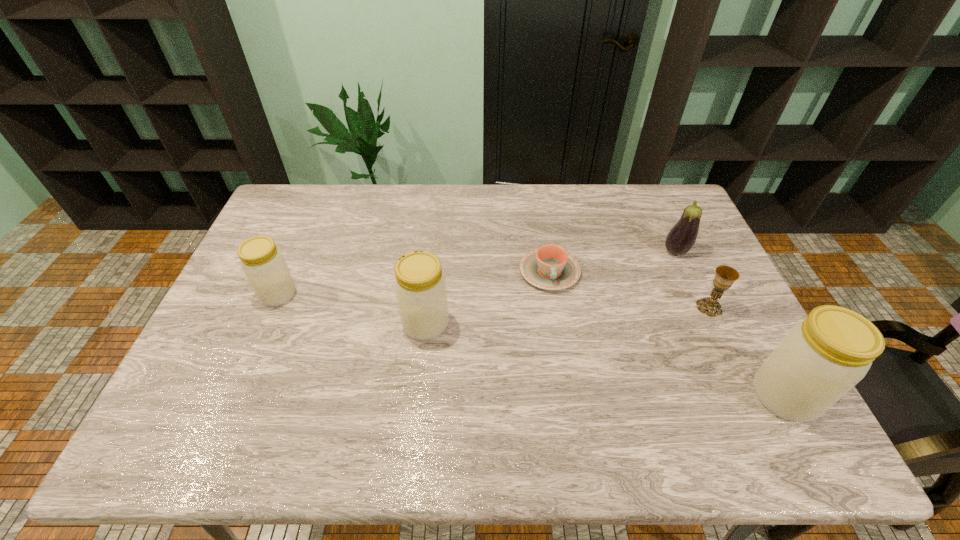
Where is `free space for an extra jar to achieve even spacing`? free space for an extra jar to achieve even spacing is located at coordinates (593, 357).